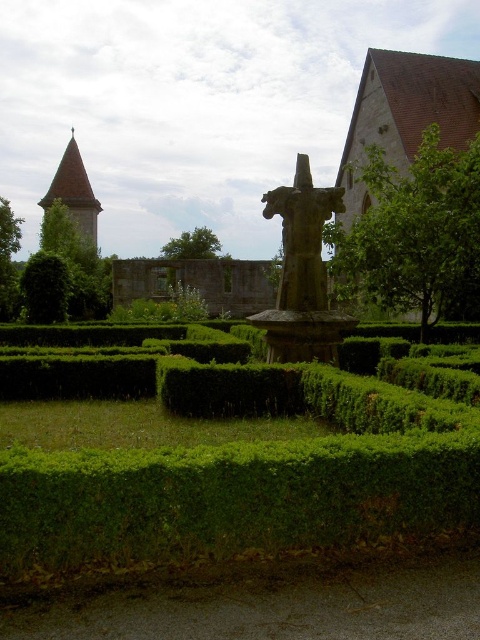
Is point (96, 216) farther from viewer compared to point (58, 273)?

Yes.

Is point (58, 193) closer to camera compared to point (41, 252)?

No, (58, 193) is behind (41, 252).

At what (x,y) coordinates should I click in order to perform the action: click on smooth stone tower at upper left. Please return your answer as a coordinate pair (x, y). This screenshot has height=640, width=480. Looking at the image, I should click on (74, 195).

Who is higher up, stone statue at center or green leafy tree at left?

green leafy tree at left is higher up.

Does stone statue at center have a smaller size compared to green leafy tree at left?

Correct, stone statue at center occupies less space than green leafy tree at left.

This screenshot has height=640, width=480. I want to click on stone statue at center, so click(x=302, y=275).

Which is in front, point (408, 449) or point (12, 280)?

Point (408, 449) is in front.

Is green leafy hedge at center above green leafy tree at left?

No, green leafy hedge at center is not above green leafy tree at left.

This screenshot has width=480, height=640. I want to click on green leafy hedge at center, so (x=230, y=461).